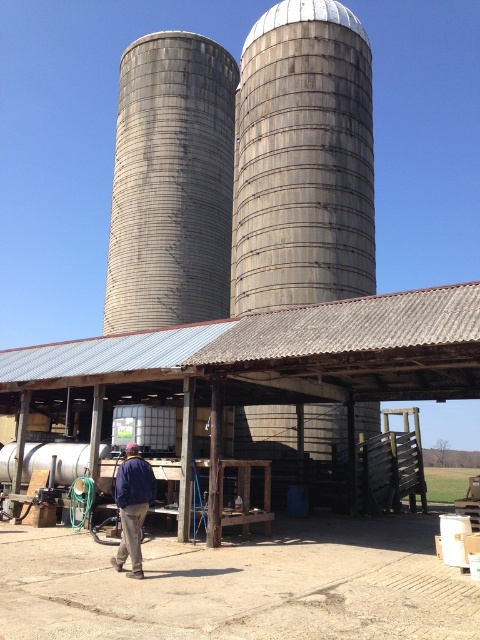
Question: Based on their relative distances, which object is nearer to the blue denim jacket at lower left?

Choices:
 (A) gray concrete silo at center
 (B) gray metallic silo at center
 (C) rustic wood barn at center

Answer: (C)

Question: Is rustic wood barn at center wider than gray metallic silo at center?

Choices:
 (A) yes
 (B) no

Answer: (A)

Question: Among these points, which one is nearest to the camera?

Choices:
 (A) (13, 385)
 (B) (127, 468)
 (C) (143, 115)
 (D) (362, 100)

Answer: (B)

Question: Does gray metallic silo at center have a greater width compared to blue denim jacket at lower left?

Choices:
 (A) yes
 (B) no

Answer: (A)

Question: Among these points, which one is nearest to the camera?

Choices:
 (A) (427, 378)
 (B) (121, 522)
 (C) (189, 292)

Answer: (B)

Question: Can you confirm if gray concrete silo at center is positioned to the right of blue denim jacket at lower left?

Choices:
 (A) yes
 (B) no

Answer: (B)